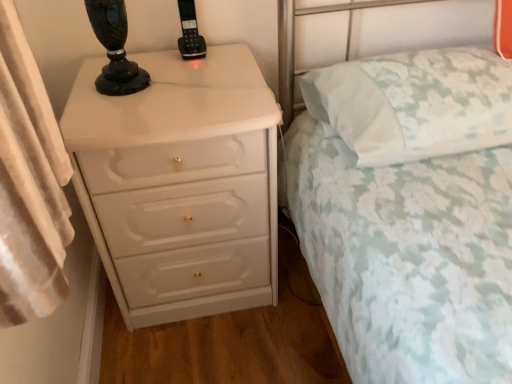
Find the location of a particular element. The width and height of the screenshot is (512, 384). vacant space positioned to the left of black plastic phone at upper center is located at coordinates (146, 54).